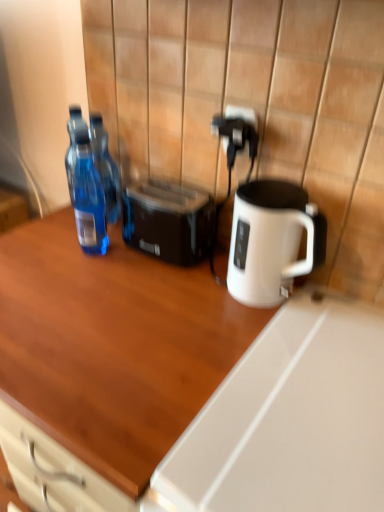
Question: Is transparent plastic bottle at left, which ranks as the first bottle in back-to-front order, shorter than black plastic electric outlet at upper right?

Choices:
 (A) no
 (B) yes

Answer: (A)

Question: Is transparent plastic bottle at left, which ranks as the first bottle in back-to-front order, thinner than black plastic electric outlet at upper right?

Choices:
 (A) no
 (B) yes

Answer: (A)

Question: From a real-world perspective, is transparent plastic bottle at left, the second bottle in the front-to-back sequence, on top of black plastic electric outlet at upper right?

Choices:
 (A) no
 (B) yes

Answer: (A)

Question: Does transparent plastic bottle at left, which ranks as the first bottle in back-to-front order, have a smaller size compared to black plastic electric outlet at upper right?

Choices:
 (A) yes
 (B) no

Answer: (B)

Question: Is transparent plastic bottle at left, which ranks as the first bottle in back-to-front order, to the left of black plastic electric outlet at upper right from the viewer's perspective?

Choices:
 (A) no
 (B) yes

Answer: (B)

Question: Can you confirm if transparent plastic bottle at left, the second bottle in the front-to-back sequence, is wider than black plastic electric outlet at upper right?

Choices:
 (A) no
 (B) yes

Answer: (B)

Question: Could you tell me if transparent plastic bottle at left, the second bottle positioned from the back, is facing transparent plastic bottle at left, the second bottle in the front-to-back sequence?

Choices:
 (A) no
 (B) yes

Answer: (A)

Question: Are transparent plastic bottle at left, the second bottle positioned from the back, and transparent plastic bottle at left, which ranks as the first bottle in back-to-front order, located far from each other?

Choices:
 (A) yes
 (B) no

Answer: (B)

Question: Would you say transparent plastic bottle at left, the second bottle positioned from the back, is outside transparent plastic bottle at left, the second bottle in the front-to-back sequence?

Choices:
 (A) yes
 (B) no

Answer: (A)

Question: From the image's perspective, is transparent plastic bottle at left, the 1th bottle positioned from the front, on transparent plastic bottle at left, which ranks as the first bottle in back-to-front order?

Choices:
 (A) no
 (B) yes

Answer: (A)

Question: Considering the relative sizes of transparent plastic bottle at left, the 1th bottle positioned from the front, and transparent plastic bottle at left, the second bottle in the front-to-back sequence, in the image provided, is transparent plastic bottle at left, the 1th bottle positioned from the front, taller than transparent plastic bottle at left, the second bottle in the front-to-back sequence,?

Choices:
 (A) no
 (B) yes

Answer: (B)

Question: Is transparent plastic bottle at left, the second bottle positioned from the back, bigger than transparent plastic bottle at left, which ranks as the first bottle in back-to-front order?

Choices:
 (A) no
 (B) yes

Answer: (A)

Question: Does wooden desk at center appear on the left side of black plastic toaster at center?

Choices:
 (A) no
 (B) yes

Answer: (B)